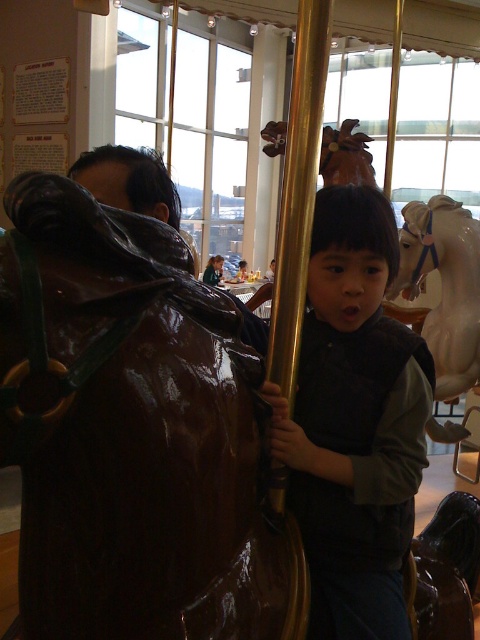
Is matte black vest at center to the right of white glossy horse at center from the viewer's perspective?

In fact, matte black vest at center is to the left of white glossy horse at center.

Is matte black vest at center above white glossy horse at center?

Incorrect, matte black vest at center is not positioned above white glossy horse at center.

Is point (321, 532) more distant than point (435, 211)?

No.

You are a GUI agent. You are given a task and a screenshot of the screen. Output one action in this format:
    pyautogui.click(x=<x>, y=<y>)
    Task: Click on the matte black vest at center
    This screenshot has width=480, height=640.
    Given the screenshot: What is the action you would take?
    pyautogui.click(x=355, y=420)

Is glossy brown horse at left closer to the viewer compared to white glossy horse at center?

Yes, it is.

Between point (142, 600) and point (411, 298), which one is positioned behind?

The point (411, 298) is behind.

Between point (15, 224) and point (462, 314), which one is positioned behind?

Positioned behind is point (462, 314).

The height and width of the screenshot is (640, 480). Identify the location of glossy brown horse at left. (132, 435).

Does glossy brown horse at left have a smaller size compared to matte black vest at center?

No.

Where is `glossy brown horse at left`? Image resolution: width=480 pixels, height=640 pixels. glossy brown horse at left is located at coordinates (132, 435).